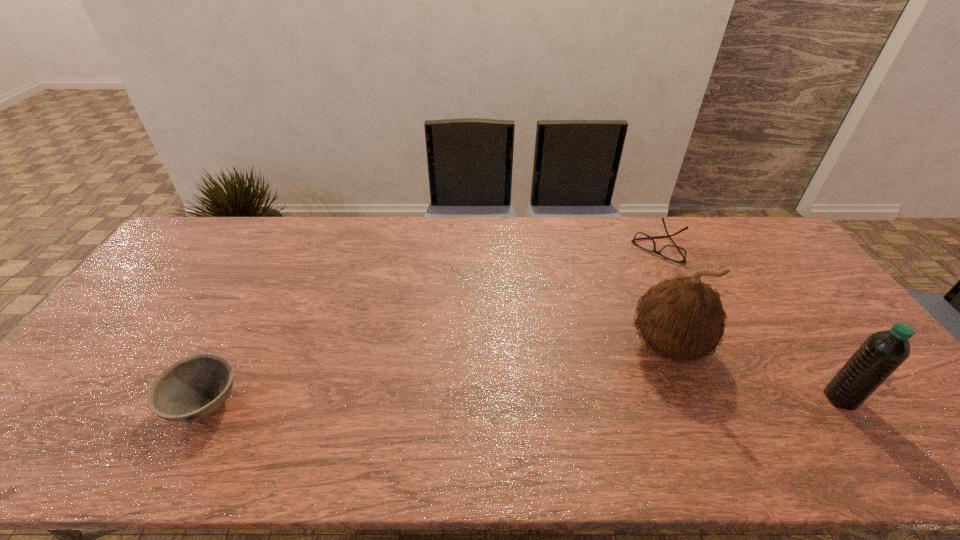
Identify the location of bowl. Image resolution: width=960 pixels, height=540 pixels. pyautogui.click(x=194, y=387).

You are a GUI agent. You are given a task and a screenshot of the screen. Output one action in this format:
    pyautogui.click(x=<x>, y=<y>)
    Task: Click on the leftmost object
    This screenshot has height=540, width=960.
    Given the screenshot: What is the action you would take?
    pyautogui.click(x=194, y=387)

Where is `the second tallest object`? the second tallest object is located at coordinates (883, 352).

Identify the location of water bottle. Image resolution: width=960 pixels, height=540 pixels. (883, 352).

At what (x,y) coordinates should I click in order to perform the action: click on the tallest object. Please return your answer as a coordinate pair (x, y). The height and width of the screenshot is (540, 960). Looking at the image, I should click on (683, 318).

Image resolution: width=960 pixels, height=540 pixels. I want to click on spectacles, so click(673, 252).

This screenshot has width=960, height=540. I want to click on the farthest object, so click(673, 252).

Identify the location of vacant space located 0.240m on the left of the third tallest object. This screenshot has width=960, height=540. (70, 404).

Identify the location of vacant region located 0.050m on the left of the water bottle. This screenshot has height=540, width=960. (805, 398).

Where is `vacant space located 0.210m on the surface of the coconut`? This screenshot has height=540, width=960. vacant space located 0.210m on the surface of the coconut is located at coordinates (578, 400).